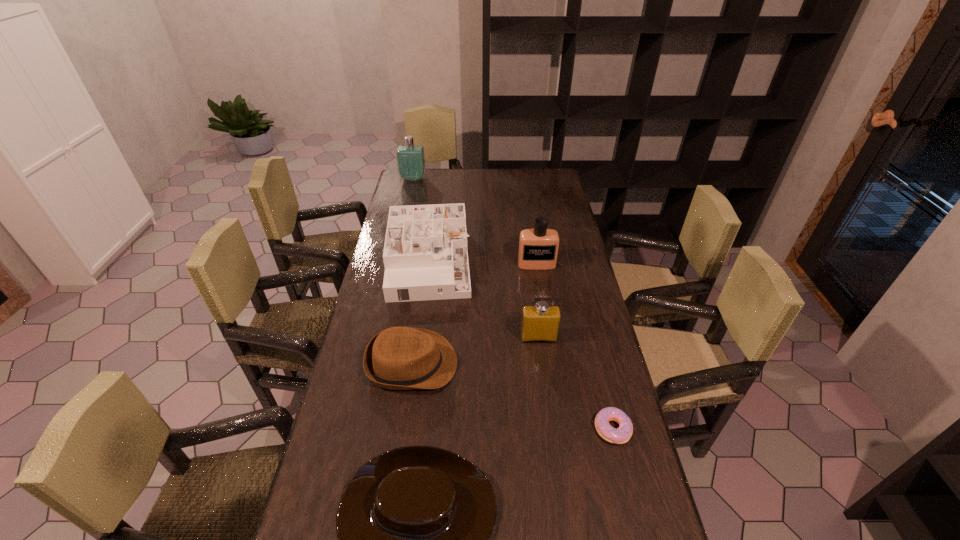
The width and height of the screenshot is (960, 540). I want to click on the farthest perfume, so [x=411, y=163].

The image size is (960, 540). I want to click on the leftmost perfume, so click(411, 163).

The image size is (960, 540). I want to click on the second farthest perfume, so click(538, 248).

Image resolution: width=960 pixels, height=540 pixels. In order to click on the nearest perfume in this screenshot , I will do `click(540, 323)`.

Find the location of `dollhouse`. dollhouse is located at coordinates (425, 255).

I want to click on fedora, so click(399, 358).

Where is `doughnut`? doughnut is located at coordinates (621, 435).

Locate an element on the screen. This screenshot has width=960, height=540. the rightmost object is located at coordinates (621, 435).

You are a GUI agent. You are given a task and a screenshot of the screen. Output one action in this format:
    pyautogui.click(x=<x>, y=<y>)
    Task: Click on the vacant region located on the front label of the leftmost perfume
    
    Given the screenshot: What is the action you would take?
    pyautogui.click(x=401, y=231)

Locate an element on the screen. The width and height of the screenshot is (960, 540). free space located on the front label of the second farthest perfume is located at coordinates (540, 290).